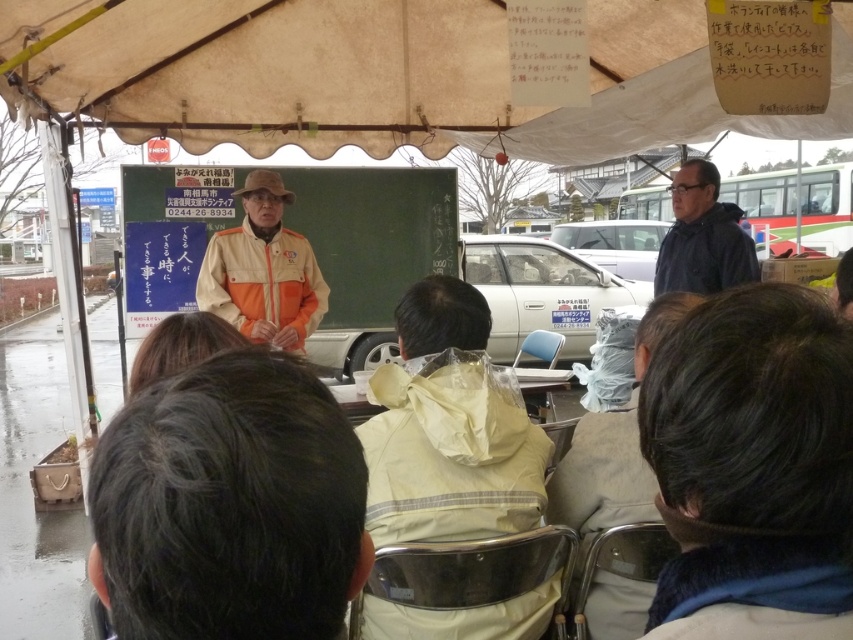
Question: Is the position of white fabric canopy at upper center more distant than that of beige fabric jacket at center?

Choices:
 (A) yes
 (B) no

Answer: (A)

Question: Which object is closer to the camera taking this photo?

Choices:
 (A) yellow plastic table at center
 (B) orange fabric jacket at center

Answer: (B)

Question: Is dark brown hair at lower right above dark blue jacket at upper right?

Choices:
 (A) no
 (B) yes

Answer: (A)

Question: Considering the real-world distances, which object is closest to the yellow matte jacket at center?

Choices:
 (A) dark blue jacket at upper right
 (B) orange fabric jacket at center
 (C) green chalkboard at center

Answer: (B)

Question: Can you confirm if dark brown hair at lower right is bigger than orange fabric jacket at center?

Choices:
 (A) no
 (B) yes

Answer: (A)

Question: Which object appears farthest from the camera in this image?

Choices:
 (A) beige fabric jacket at center
 (B) dark brown hair at lower right

Answer: (A)